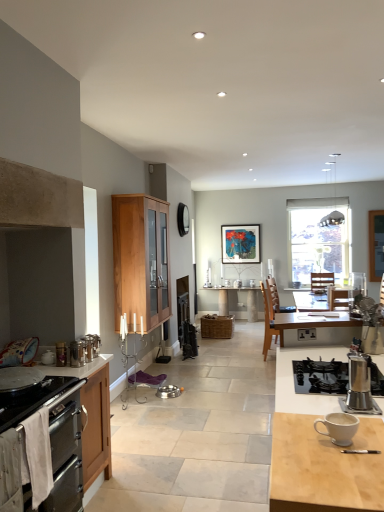
Question: Considering the positions of point (311, 335) and point (46, 435), is point (311, 335) closer or farther from the camera than point (46, 435)?

Choices:
 (A) closer
 (B) farther

Answer: (B)

Question: Looking at their shapes, would you say black plastic power outlet at center is wider or thinner than stainless steel oven at lower left, the 1th cabinetry positioned from the bottom?

Choices:
 (A) wide
 (B) thin

Answer: (B)

Question: Considering the real-world distances, which object is closest to the brown woven picnic basket at center?

Choices:
 (A) metallic silver canister at left, which ranks as the second kitchen appliance in right-to-left order
 (B) light brown wood cabinet at center, arranged as the second cabinetry when viewed from the front
 (C) light wood desk at right, marked as the 1th desk in a front-to-back arrangement
 (D) wooden chair at center
 (E) matte white sink at lower left

Answer: (D)

Question: Which object is positioned closest to the metallic silver canister at left, the 1th kitchen appliance viewed from the top?

Choices:
 (A) black plastic power outlet at center
 (B) white ceramic mug at lower right
 (C) matte black picture frame at center
 (D) light wood desk at right, marked as the 1th desk in a front-to-back arrangement
 (E) light brown wood cabinet at center, the 2th cabinetry when ordered from bottom to top

Answer: (D)